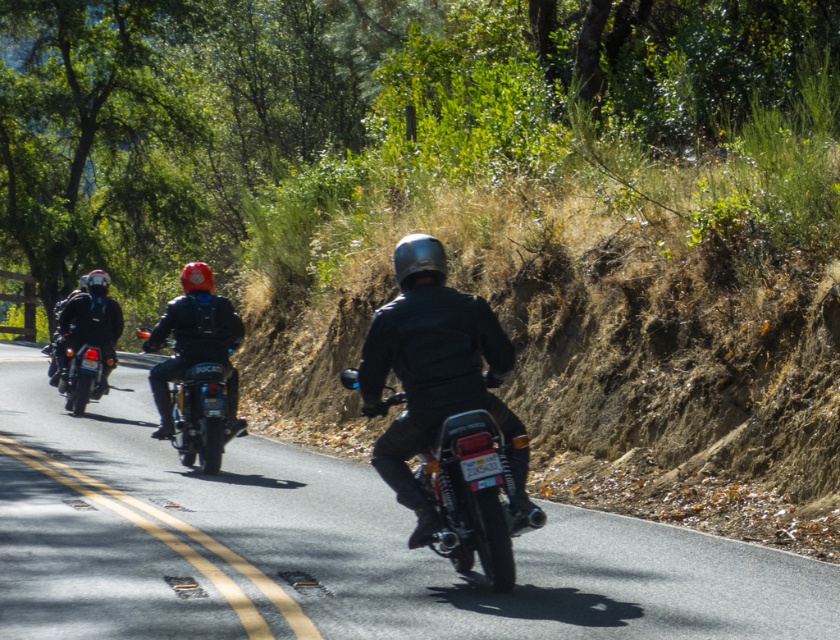
You are a photographer standing at the edge of the road. You want to take a photo that includes both the black asphalt road at center and the shiny chrome motorcycle at center. Which object will appear larger in the photo?

The shiny chrome motorcycle at center will appear larger in the photo because it has a greater height than the black asphalt road at center.